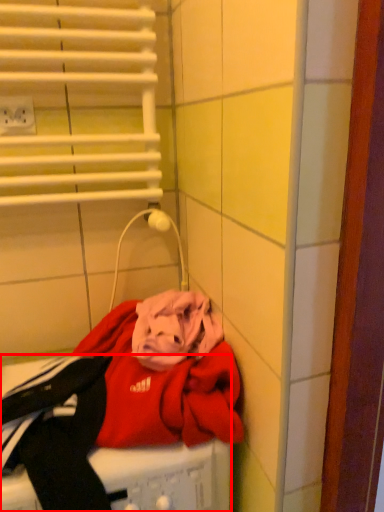
Question: From the image's perspective, where is washing machine (annotated by the red box) located relative to electric outlet?

Choices:
 (A) above
 (B) below

Answer: (B)